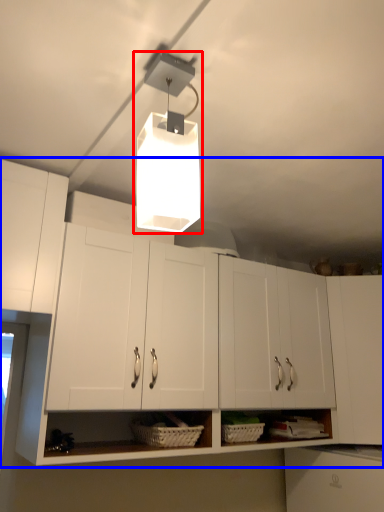
Question: Which point is closer to the camera, lamp (highlighted by a red box) or cabinetry (highlighted by a blue box)?

Choices:
 (A) lamp
 (B) cabinetry

Answer: (A)